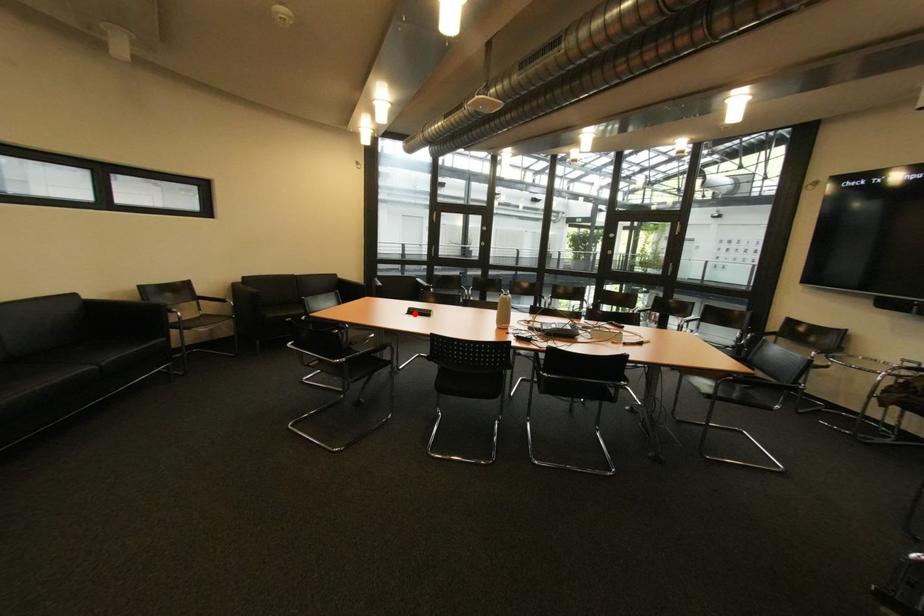
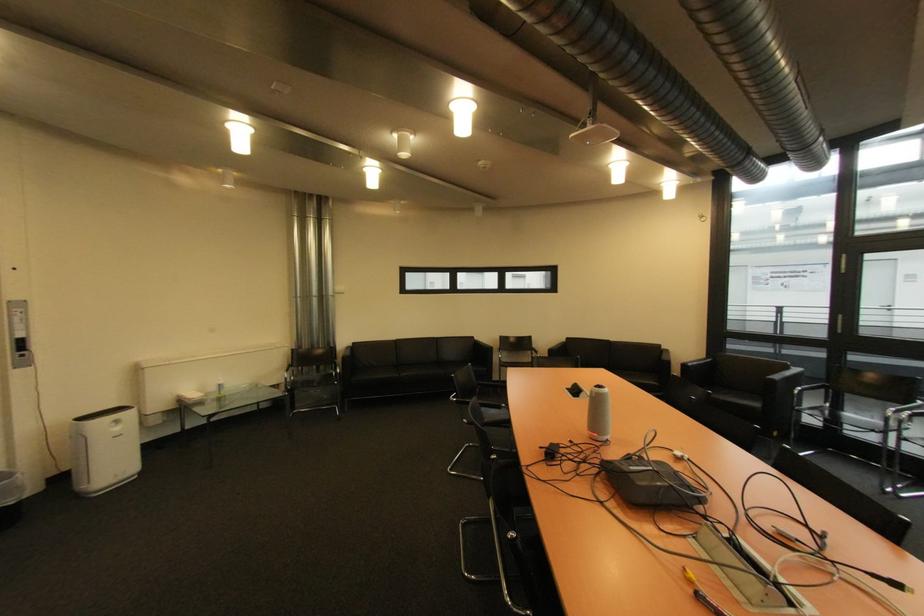
Where in the second image is the point corresponding to the highlighted location from the first image?

(578, 389)